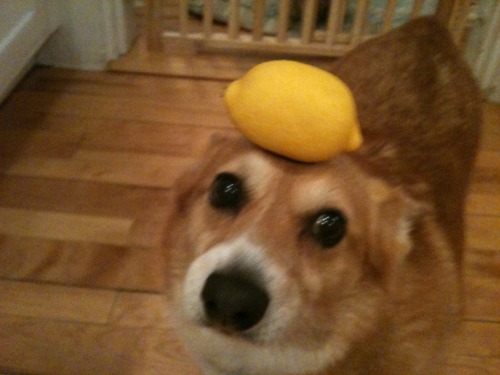
Identify the location of hardwood floor. (119, 114), (87, 244), (77, 339), (490, 294), (489, 226).